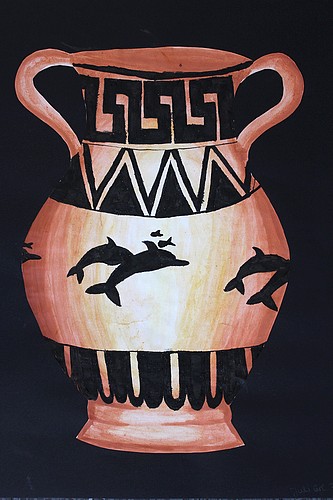
The image size is (333, 500). In order to click on right handle in this screenshot , I will do `click(287, 93)`.